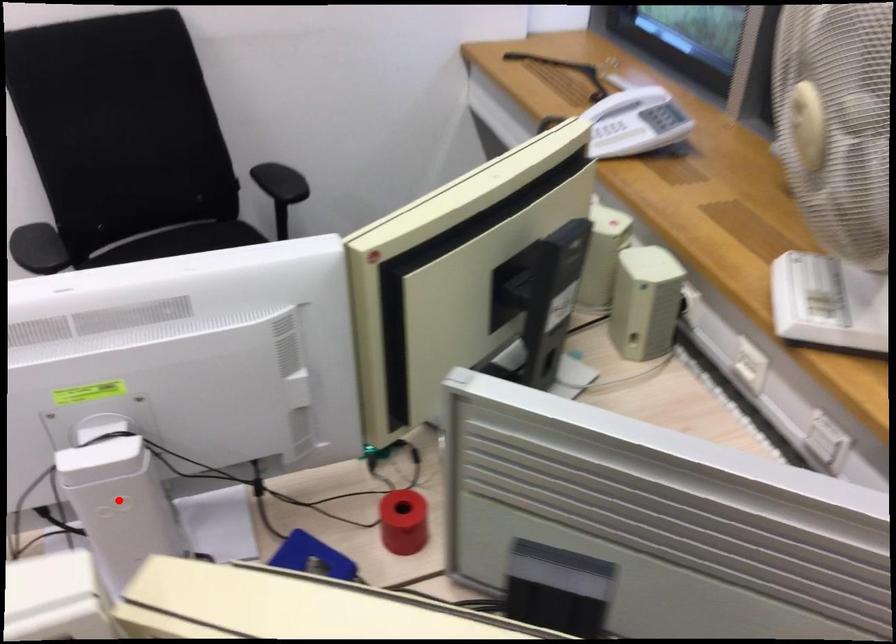
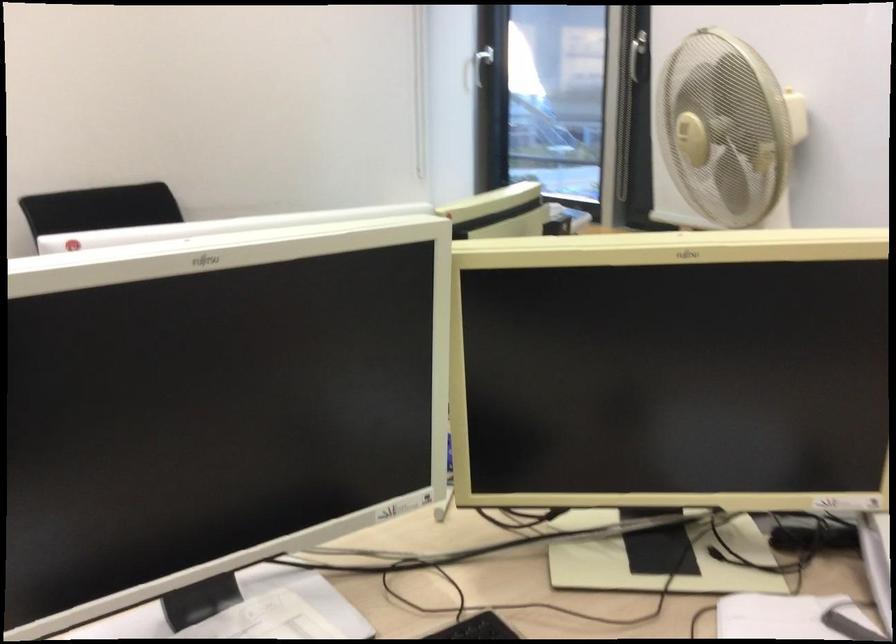
Question: I am providing you with two images of the same scene from different viewpoints. A red point is marked on the first image. Is the red point's position out of view in image 2?

Choices:
 (A) Yes
 (B) No

Answer: (A)